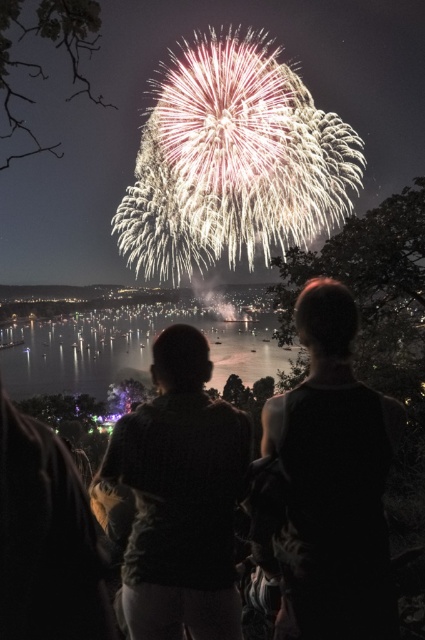
Can you confirm if dark textured shirt at center is thinner than silvery reflective water at center?

Indeed, dark textured shirt at center has a lesser width compared to silvery reflective water at center.

In the scene shown: Between dark textured shirt at center and silvery reflective water at center, which one has more height?

Standing taller between the two is dark textured shirt at center.

Is point (214, 624) behind point (50, 346)?

No, (214, 624) is closer to viewer.

Locate an element on the screen. The height and width of the screenshot is (640, 425). dark textured shirt at center is located at coordinates (181, 497).

Measure the distance from black fabric at center to dark textured shirt at center.

A distance of 101.31 feet exists between black fabric at center and dark textured shirt at center.

Between black fabric at center and dark textured shirt at center, which one is positioned lower?

Positioned lower is dark textured shirt at center.

Locate an element on the screen. Image resolution: width=425 pixels, height=640 pixels. black fabric at center is located at coordinates (333, 481).

Is black fabric at center bigger than silvery reflective water at center?

No, black fabric at center is not bigger than silvery reflective water at center.

Which is in front, point (283, 628) or point (50, 326)?

Positioned in front is point (283, 628).

The image size is (425, 640). I want to click on black fabric at center, so click(x=333, y=481).